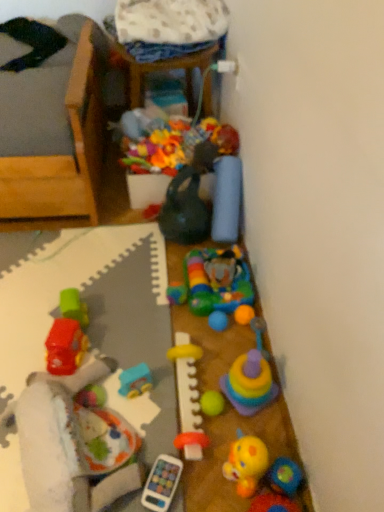
Question: Is blue fabric pillow at upper right, arranged as the 4th toy when viewed from the right, taller or shorter than matte green kettle at center, the 3th toy from the left?

Choices:
 (A) short
 (B) tall

Answer: (A)

Question: Would you say blue fabric pillow at upper right, arranged as the 4th toy when viewed from the right, is to the left or to the right of matte green kettle at center, the 3th toy from the left, in the picture?

Choices:
 (A) right
 (B) left

Answer: (A)

Question: Which object is positioned closest to the rubberized yellow duck at lower right, which is the eleventh toy from left to right?

Choices:
 (A) blue plastic toy car at center, which is the second toy from left to right
 (B) rubber duck at center, the fifth toy from the right
 (C) wooden toy box at upper center
 (D) matte green kettle at center, the 3th toy from the left
 (E) yellow rubber teething ring at center, positioned as the eighth toy in right-to-left order

Answer: (B)

Question: Estimate the real-world distances between objects in this image. Which object is closer to the blue plastic toy car at center, positioned as the tenth toy in right-to-left order?

Choices:
 (A) green rubber ball at center, which appears as the 5th toy when viewed from the left
 (B) rubberized plastic elephant at center, the 6th toy when ordered from left to right
 (C) rubberized plastic baby rattle at lower left, the 11th toy when ordered from right to left
 (D) rubber duck at center, which is the 7th toy in left-to-right order
 (E) rubberized plastic stacking cups at center-right, the ninth toy from the left

Answer: (C)